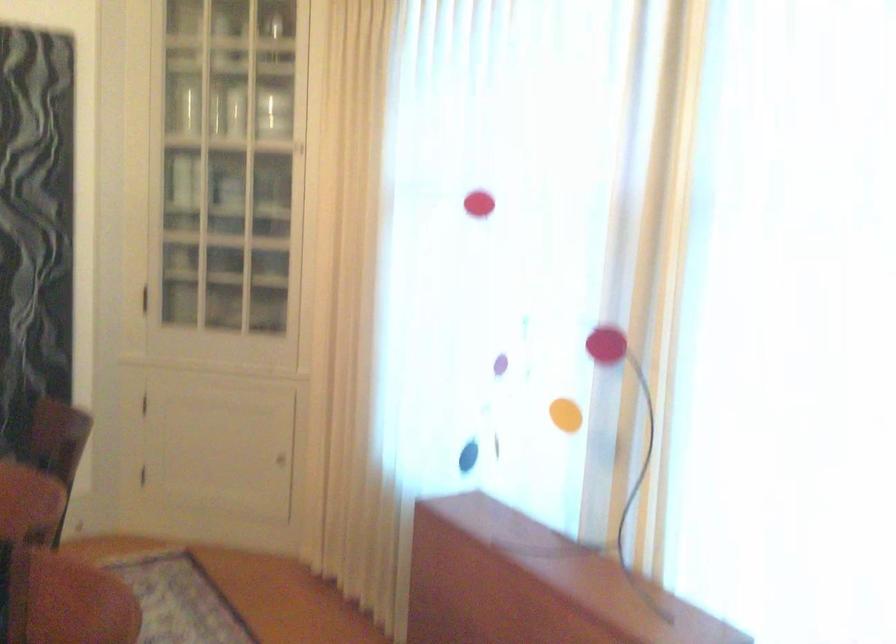
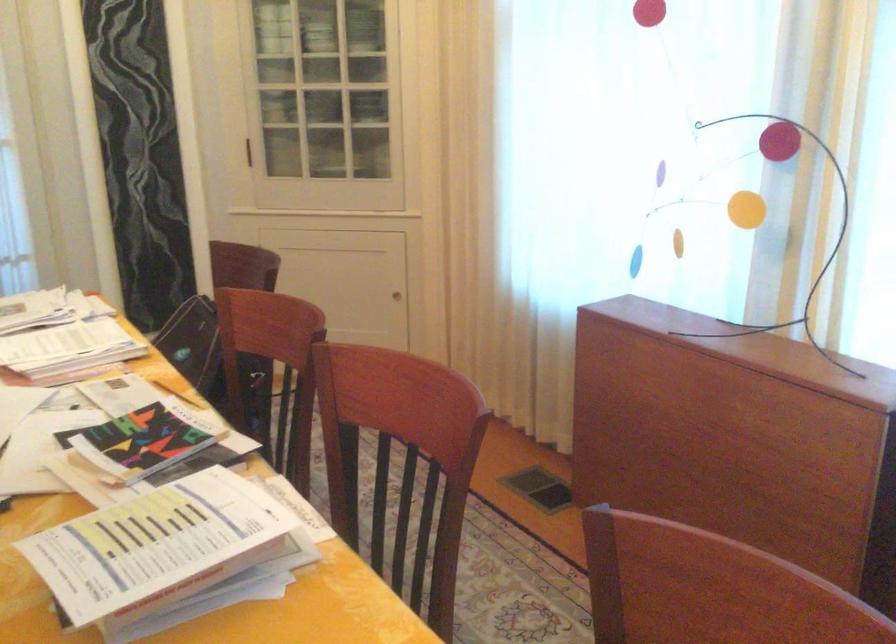
Find the pixel in the second image that matches (x=280, y=453) in the first image.

(395, 295)